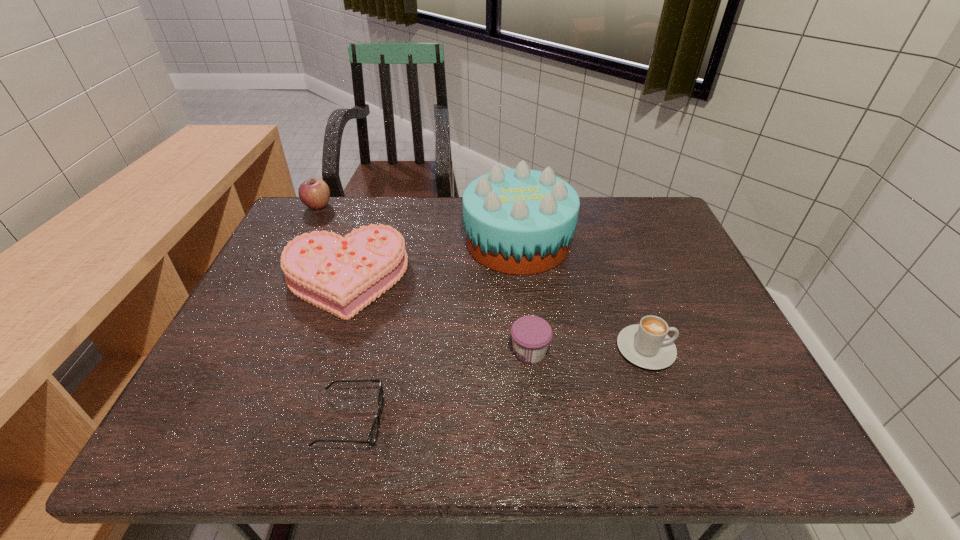
Where is `vacant point located between the cappuccino and the jam`? vacant point located between the cappuccino and the jam is located at coordinates (588, 350).

Image resolution: width=960 pixels, height=540 pixels. In order to click on unoccupied position between the jam and the apple in this screenshot , I will do `click(424, 279)`.

Find the location of `free area in between the jam and the left cake`. free area in between the jam and the left cake is located at coordinates (437, 315).

This screenshot has height=540, width=960. Identify the location of free spot between the apple and the cappuccino. (482, 278).

Image resolution: width=960 pixels, height=540 pixels. Find the location of `vacant space that's between the cappuccino and the shortest object`. vacant space that's between the cappuccino and the shortest object is located at coordinates (498, 384).

The height and width of the screenshot is (540, 960). Identify the location of vacant space that is in between the jam and the shorter cake. (437, 315).

You are a GUI agent. You are given a task and a screenshot of the screen. Output one action in this format:
    pyautogui.click(x=<x>, y=<y>)
    Task: Click on the vacant area that lies between the tallest object and the jam
    
    Given the screenshot: What is the action you would take?
    point(524,296)

Where is `object that is the second closest to the spectacles`? The height and width of the screenshot is (540, 960). object that is the second closest to the spectacles is located at coordinates (531, 335).

Identify which object is located as the third nearest to the spectacles. Please provide its 2D coordinates. Your answer should be formatted as a tuple, i.e. [(x, y)], where the tuple contains the x and y coordinates of a point satisfying the conditions above.

[(519, 221)]

Where is `blank space that satisfies the following two spatial constraints: 1. on the front side of the second tallest object; 2. on the left side of the shorter cake`? blank space that satisfies the following two spatial constraints: 1. on the front side of the second tallest object; 2. on the left side of the shorter cake is located at coordinates (282, 279).